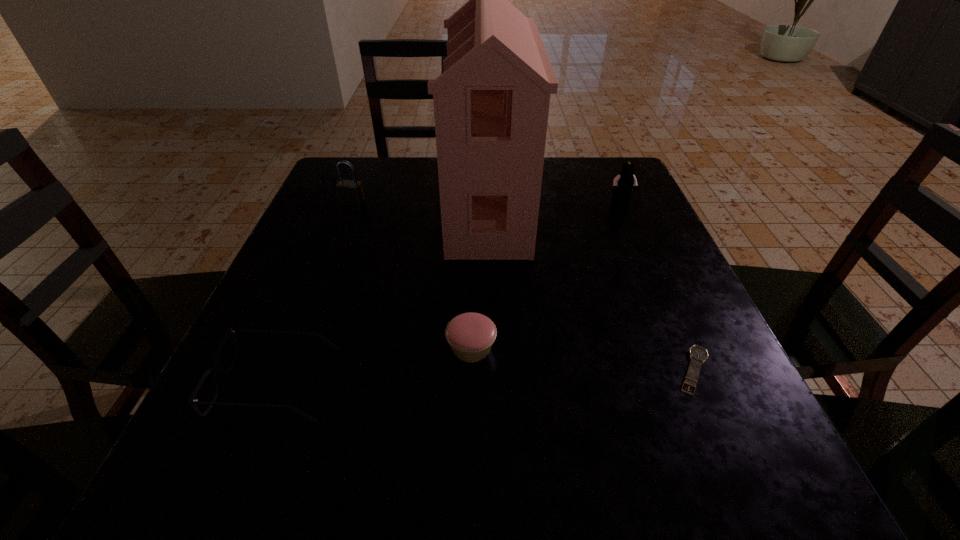
At what (x,y) coordinates should I click in order to perform the action: click on the tallest object. Please return your answer as a coordinate pair (x, y). The height and width of the screenshot is (540, 960). Looking at the image, I should click on (491, 103).

Locate an element on the screen. This screenshot has height=540, width=960. padlock is located at coordinates (350, 192).

You are a GUI agent. You are given a task and a screenshot of the screen. Output one action in this format:
    pyautogui.click(x=<x>, y=<y>)
    Task: Click on the Lego
    
    Given the screenshot: What is the action you would take?
    pyautogui.click(x=623, y=183)

Where is `spectacles`? spectacles is located at coordinates (215, 368).

Identify the location of cupcake. (471, 335).

Find the location of a particular element. This screenshot has width=960, height=540. watch is located at coordinates (698, 355).

I want to click on blank area located on the front-facing side of the tallest object, so click(324, 204).

Find the location of `vacant space situated 0.080m on the front-facing side of the tallest object`. vacant space situated 0.080m on the front-facing side of the tallest object is located at coordinates (413, 204).

Identify the location of free point located on the front-facing side of the tallest object. The height and width of the screenshot is (540, 960). (388, 204).

I want to click on blank space located on the front of the padlock, so 303,329.